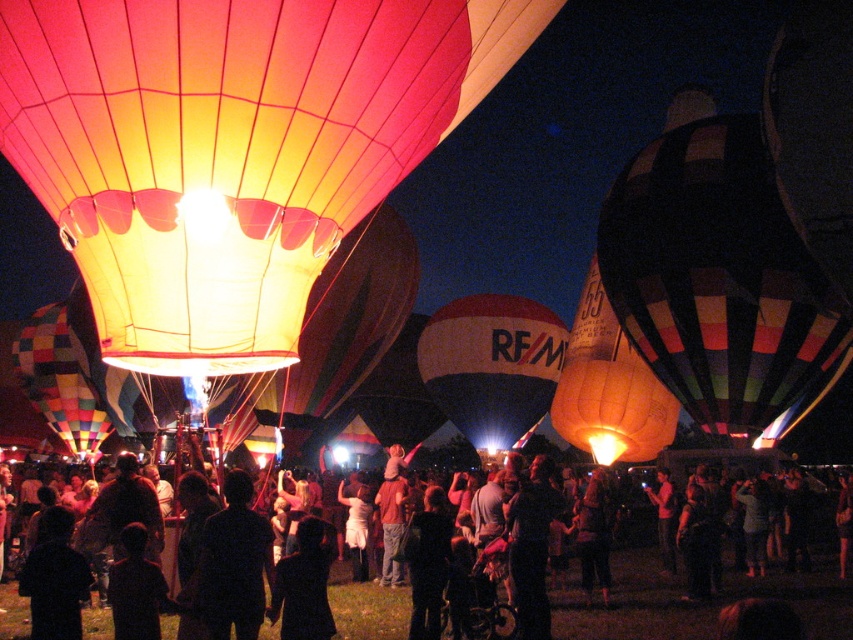
Question: Which object is farther from the camera taking this photo?

Choices:
 (A) dark fabric coat at center
 (B) multicolored striped hot air balloon at center
 (C) matte black crowd at center

Answer: (B)

Question: Which point is closer to the camera?

Choices:
 (A) (674, 596)
 (B) (328, 634)
 (C) (512, 352)

Answer: (B)

Question: Is matte black crowd at center to the left of multicolored striped hot air balloon at center from the viewer's perspective?

Choices:
 (A) no
 (B) yes

Answer: (B)

Question: In this image, where is multicolored striped fabric hot air balloon at right located relative to multicolored striped hot air balloon at center?

Choices:
 (A) right
 (B) left

Answer: (A)

Question: Which object is closer to the camera taking this photo?

Choices:
 (A) multicolored striped hot air balloon at center
 (B) white and red striped balloon at center
 (C) matte black crowd at center
 (D) multicolored striped fabric hot air balloon at right

Answer: (C)

Question: Is multicolored striped fabric hot air balloon at right in front of multicolored striped hot air balloon at center?

Choices:
 (A) no
 (B) yes

Answer: (B)